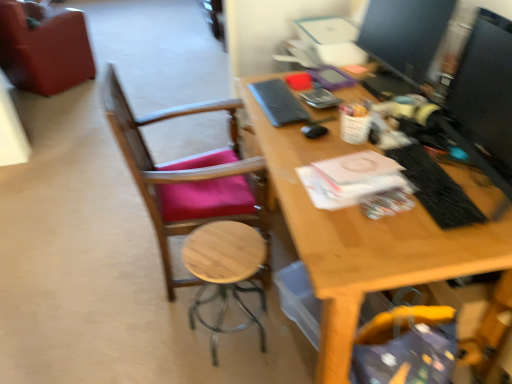
Where is `free space above wooden stool at center (from a real-world perspective)`? free space above wooden stool at center (from a real-world perspective) is located at coordinates (226, 259).